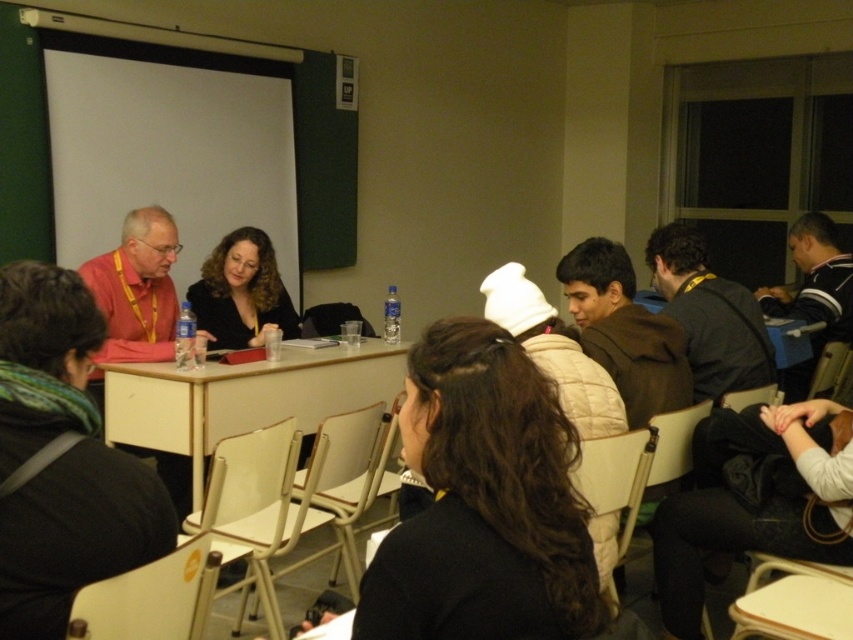
You are organizing a classroom activity and need to arrange two items on a desk. You have a black matte jacket at center and a striped sweater at right. Which item requires more space on the desk?

The striped sweater at right requires more space on the desk because the black matte jacket at center occupies less space than the striped sweater at right.

You are standing at the entrance of the classroom and want to locate the dark gray sweater at center right. Based on the coordinates provided, can you determine its position relative to the center of the room?

The dark gray sweater at center right is located at coordinates approximately 0.494 on the x axis and 0.832 on the y axis, which places it slightly to the right of the center point along the horizontal axis and closer to the bottom of the room vertically.

You are standing at the entrance of the classroom and see the point marked at coordinates [485,502]. What object is located at that point?

The point marked at coordinates [485,502] corresponds to the black matte jacket at center.